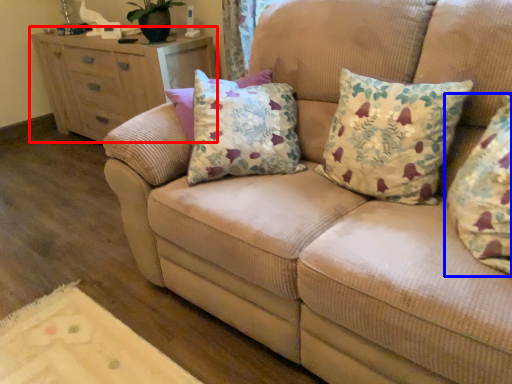
Question: Among these objects, which one is farthest to the camera, chest of drawers (highlighted by a red box) or pillow (highlighted by a blue box)?

Choices:
 (A) chest of drawers
 (B) pillow

Answer: (A)